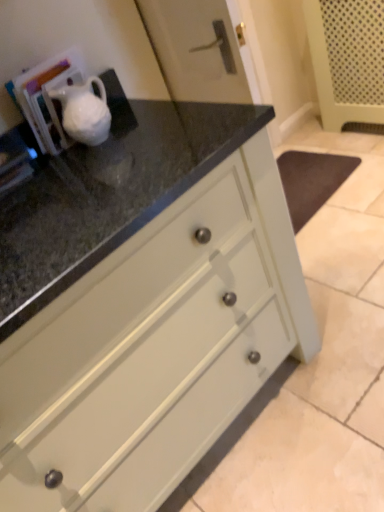
What do you see at coordinates (156, 347) in the screenshot?
I see `white matte cabinet at center` at bounding box center [156, 347].

Identify the location of white matte cabinet at center. The width and height of the screenshot is (384, 512). (156, 347).

This screenshot has height=512, width=384. I want to click on white matte cabinet at center, so click(x=156, y=347).